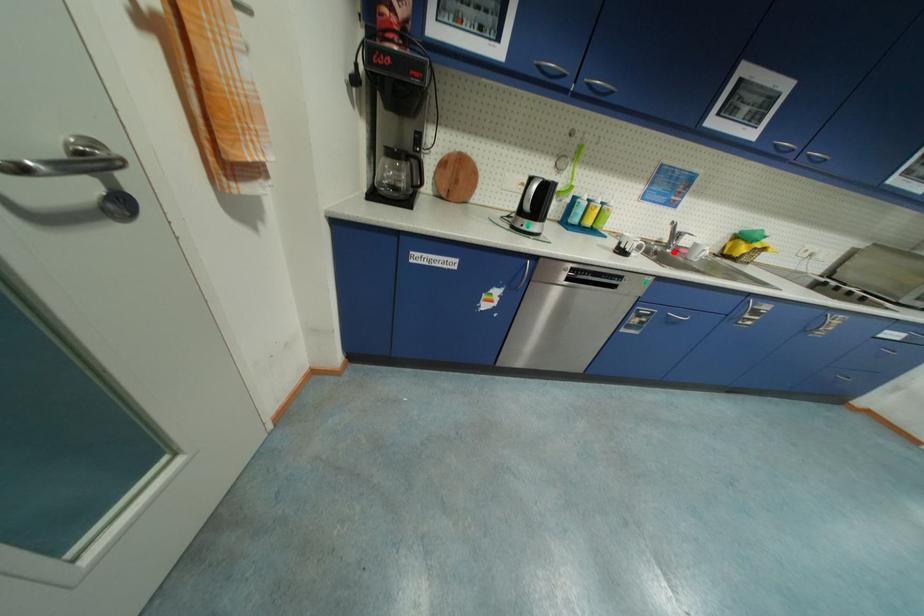
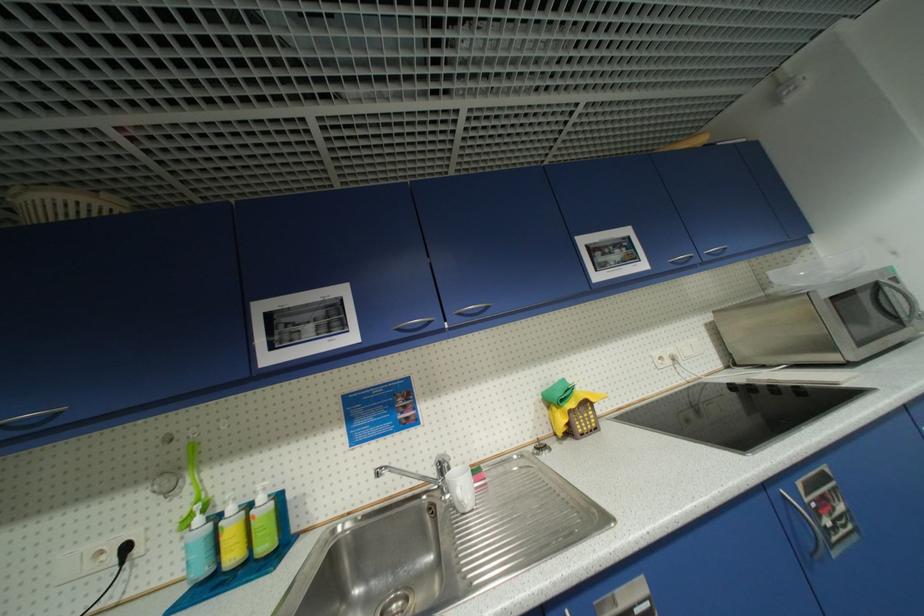
The point at the highlighted location is marked in the first image. Where is the corresponding point in the second image?

(454, 496)